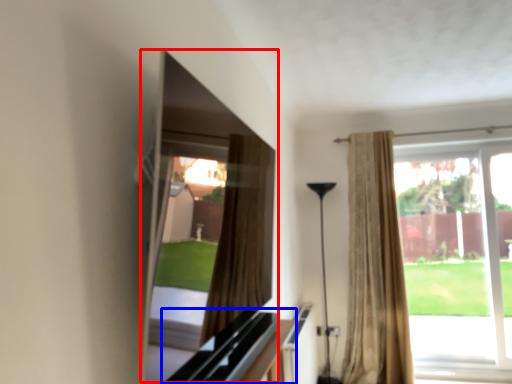
Question: Which object is closer to the camera taking this photo, window screen (highlighted by a red box) or dresser (highlighted by a blue box)?

Choices:
 (A) window screen
 (B) dresser

Answer: (A)